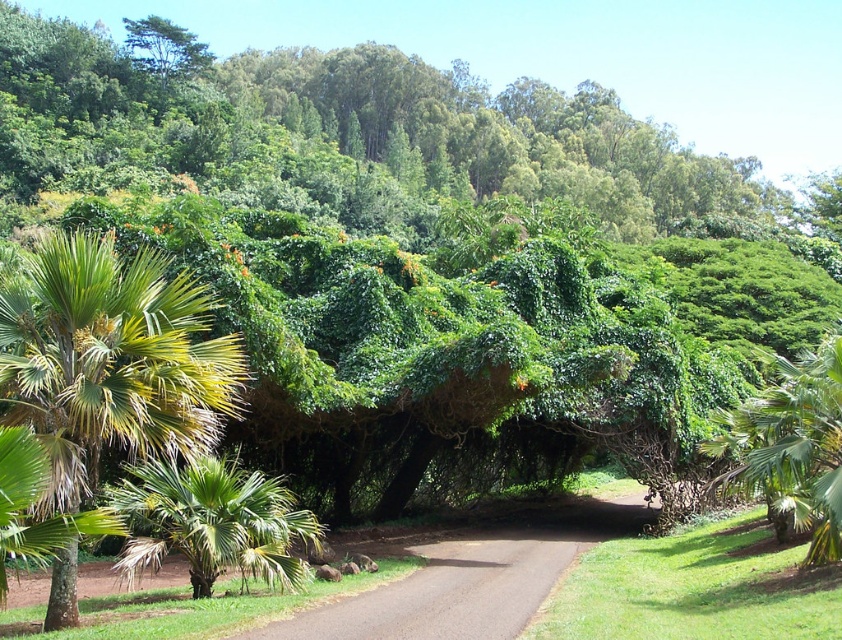
Question: Which object is the farthest from the green leafy palm at left?

Choices:
 (A) green leafy palm tree at lower left
 (B) green leafy palm tree at center

Answer: (B)

Question: Among these points, which one is nearest to the camera?

Choices:
 (A) (291, 541)
 (B) (835, 385)
 (C) (62, 397)

Answer: (C)

Question: Does green leafy palm tree at lower left appear under green leafy palm tree at center?

Choices:
 (A) no
 (B) yes

Answer: (B)

Question: Is green leafy palm at left bigger than green leafy palm tree at center?

Choices:
 (A) no
 (B) yes

Answer: (A)

Question: Among these objects, which one is farthest from the camera?

Choices:
 (A) green leafy palm at left
 (B) green leafy palm tree at center
 (C) green leafy palm tree at lower left

Answer: (C)

Question: Does green leafy palm at left lie behind green leafy palm tree at center?

Choices:
 (A) no
 (B) yes

Answer: (A)